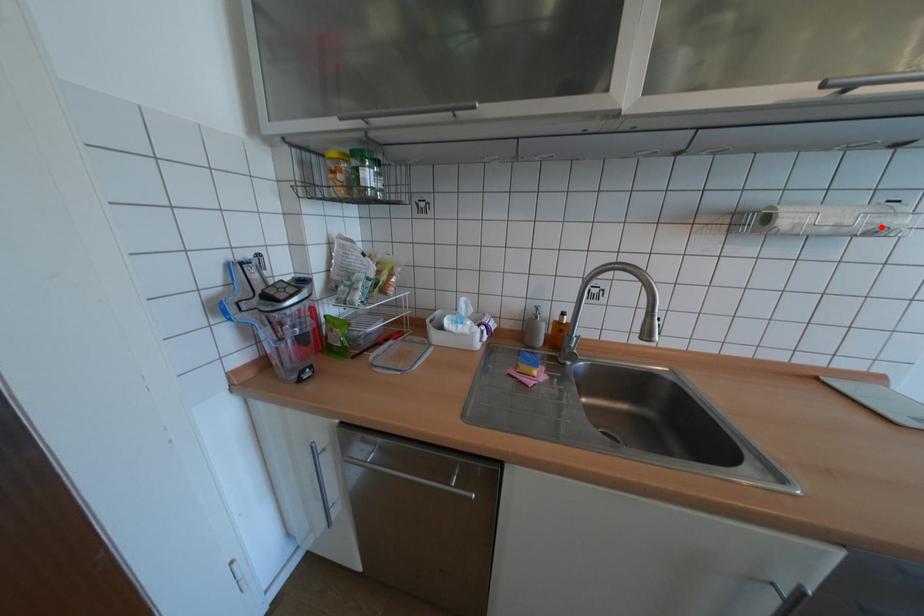
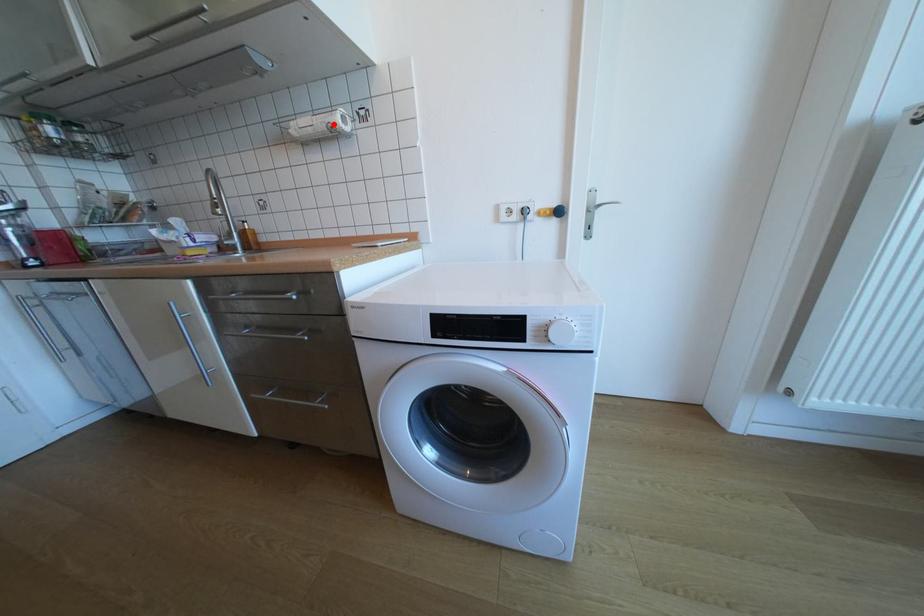
I am providing you with two images of the same scene from different viewpoints. A red point is marked on the first image and another point is marked on the second image. Does the point marked in image1 correspond to the same location as the one in image2?

Yes